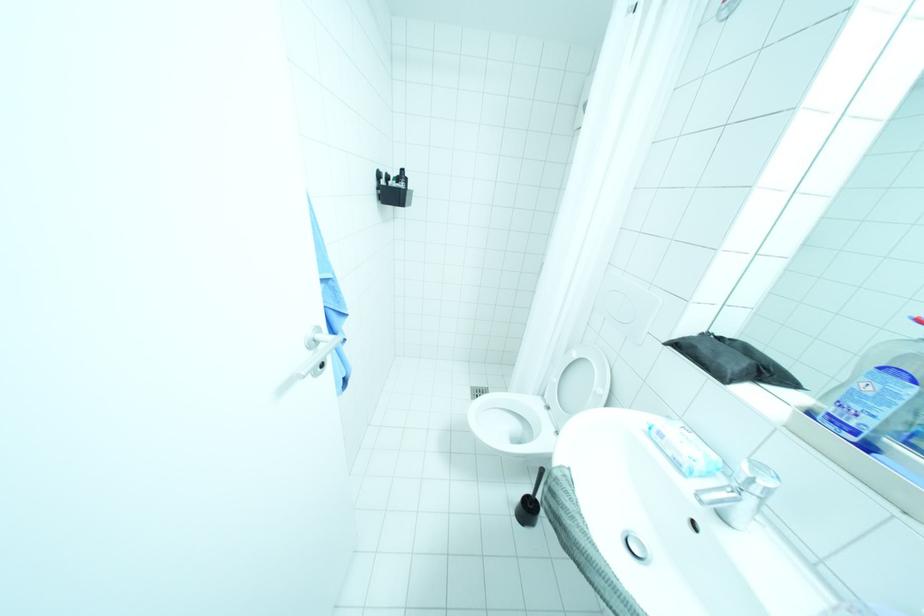
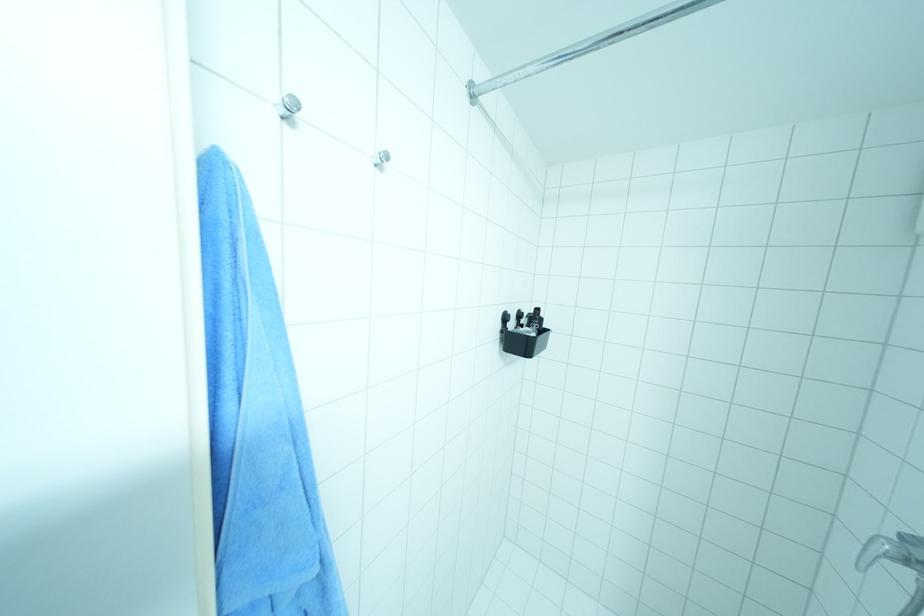
Question: I am providing you with two images of the same scene from different viewpoints. Please identify which objects are invisible in image2.

Choices:
 (A) black toothbrush
 (B) silver wall hook
 (C) shower faucet handle
 (D) none of these

Answer: (D)